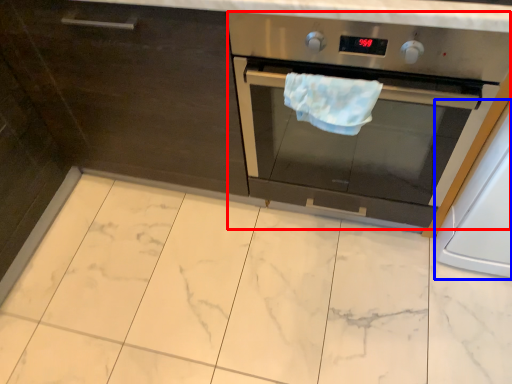
Question: Among these objects, which one is nearest to the camera, home appliance (highlighted by a red box) or appliance (highlighted by a blue box)?

Choices:
 (A) home appliance
 (B) appliance

Answer: (A)